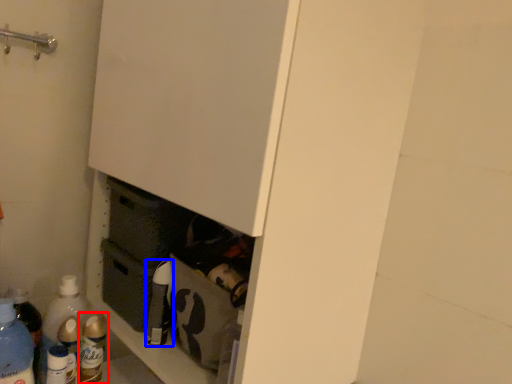
Question: Which object appears closest to the camera in this image, bottle (highlighted by a red box) or bottle (highlighted by a blue box)?

Choices:
 (A) bottle
 (B) bottle

Answer: (B)